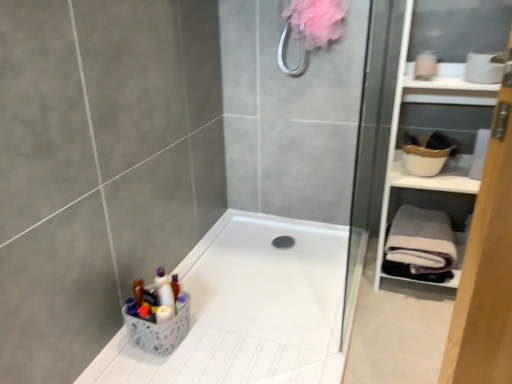
I want to click on vacant area that is in front of white plastic basket at lower left, so click(x=161, y=359).